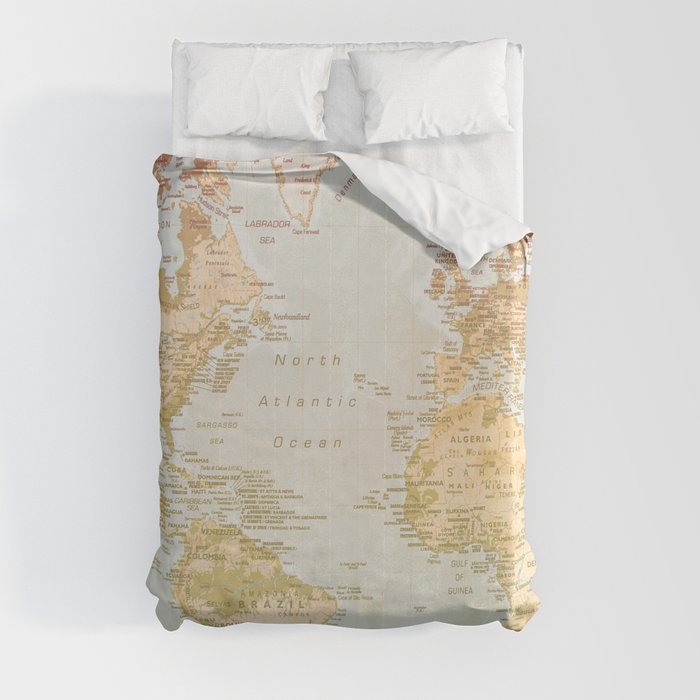
Identify the location of bent corner of blanket. (451, 215).